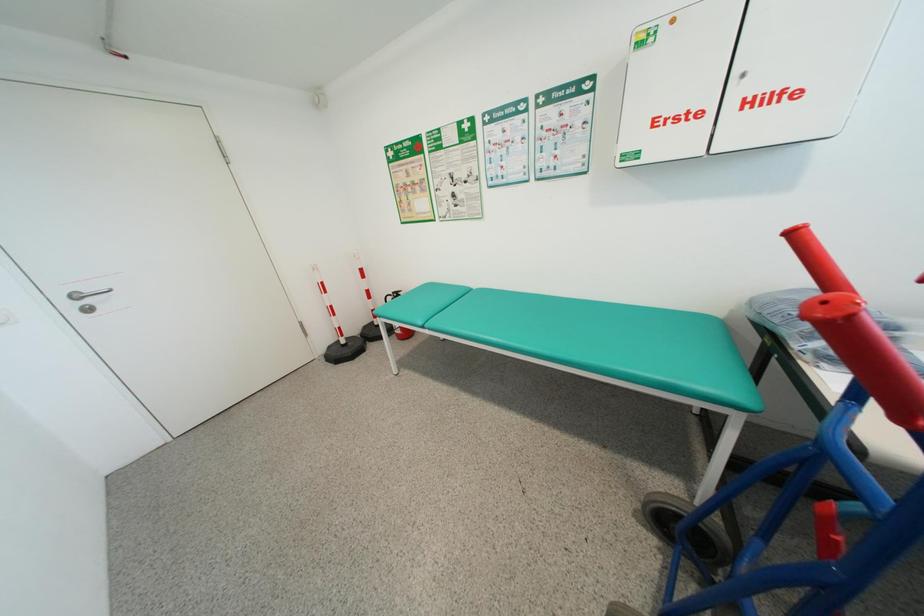
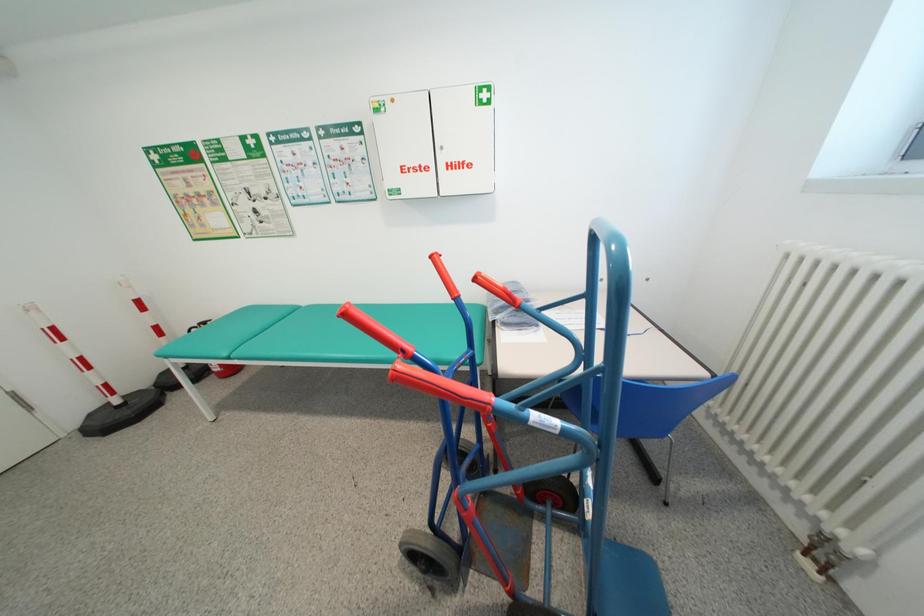
Which direction would the cameraman need to move to produce the second image?

The movement direction of the cameraman is right, backward.